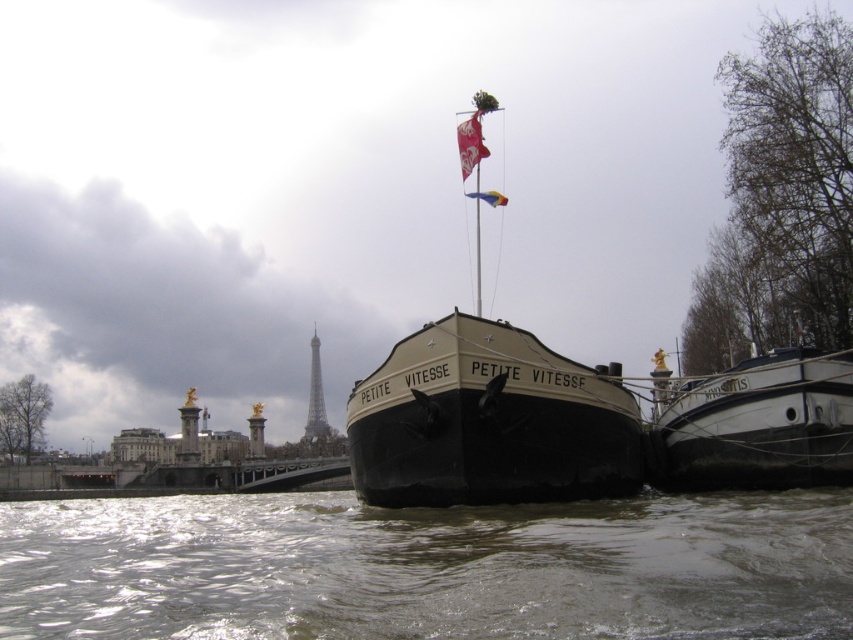
Question: Which point is farther to the camera?

Choices:
 (A) red fabric flag at upper center
 (B) brown murky water at lower center

Answer: (A)

Question: Is brown murky water at lower center closer to camera compared to white matte boat at right?

Choices:
 (A) yes
 (B) no

Answer: (A)

Question: Is white matte boat at right thinner than red fabric flag at upper center?

Choices:
 (A) yes
 (B) no

Answer: (B)

Question: Estimate the real-world distances between objects in this image. Which object is farther from the metallic gray tower at center?

Choices:
 (A) brown murky water at lower center
 (B) beige matte barge at center
 (C) rainbow fabric flag at upper center

Answer: (B)

Question: Does beige matte barge at center have a lesser width compared to white matte boat at right?

Choices:
 (A) no
 (B) yes

Answer: (B)

Question: Among these objects, which one is nearest to the camera?

Choices:
 (A) white matte boat at right
 (B) beige matte barge at center
 (C) brown murky water at lower center

Answer: (C)